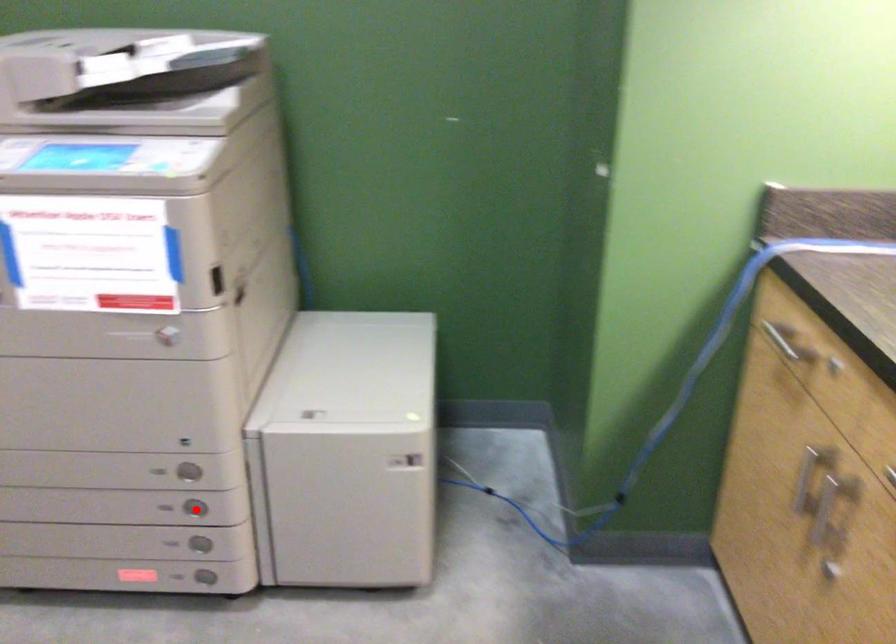
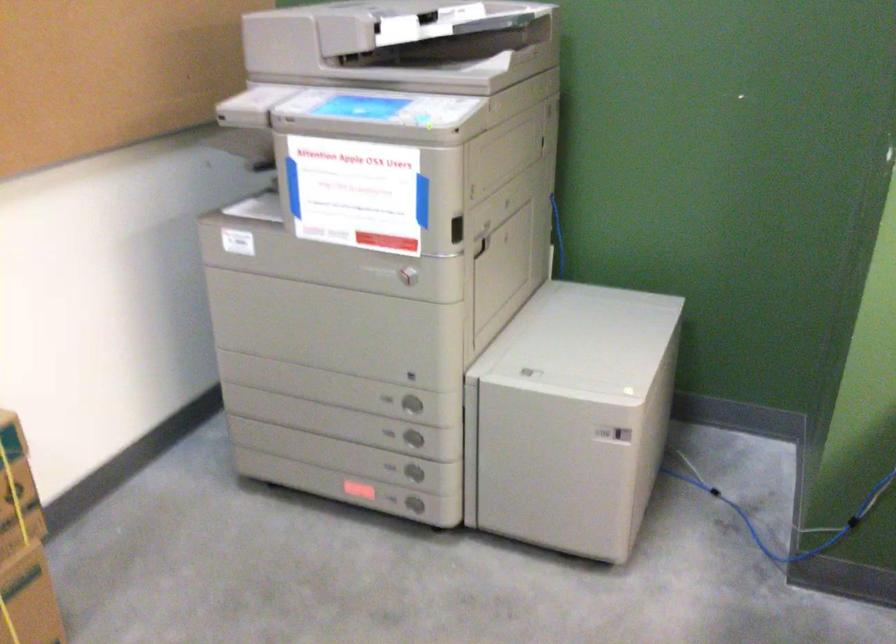
In the second image, find the point that corresponds to the highlighted location in the first image.

(412, 438)